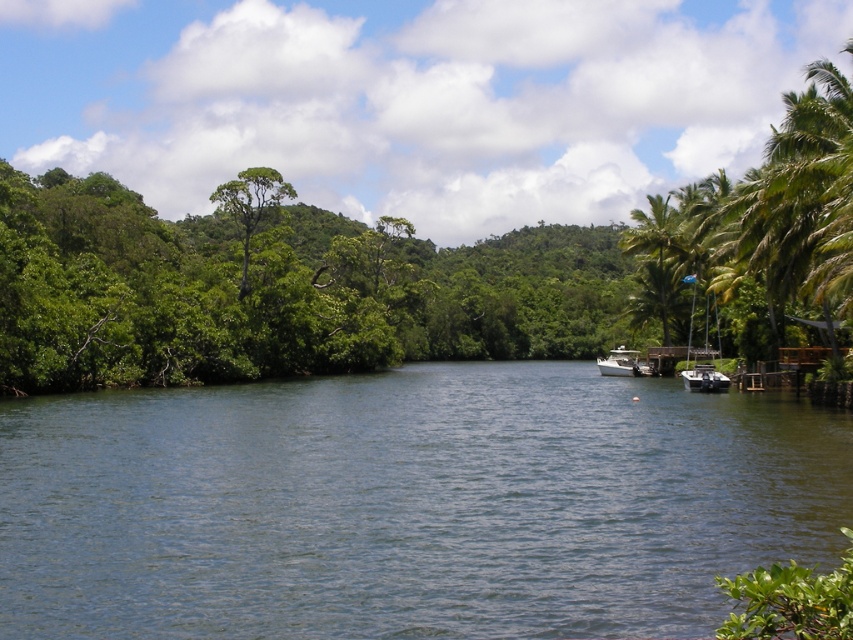
Does metallic silver boat at right appear over white glossy boat at center?

Actually, metallic silver boat at right is below white glossy boat at center.

Between point (698, 372) and point (602, 372), which one is positioned in front?

Positioned in front is point (698, 372).

This screenshot has width=853, height=640. What do you see at coordinates (704, 378) in the screenshot?
I see `metallic silver boat at right` at bounding box center [704, 378].

Locate an element on the screen. This screenshot has width=853, height=640. metallic silver boat at right is located at coordinates (704, 378).

Does green leafy tree at right appear on the right side of green leafy tree at center?

Yes, green leafy tree at right is to the right of green leafy tree at center.

Does green leafy tree at right appear on the left side of green leafy tree at center?

In fact, green leafy tree at right is to the right of green leafy tree at center.

The width and height of the screenshot is (853, 640). In order to click on green leafy tree at right in this screenshot , I will do `click(283, 291)`.

Which is more to the right, green leafy tree at right or green leafy palm tree at right?

green leafy palm tree at right

Who is taller, green leafy tree at right or green leafy palm tree at right?

green leafy palm tree at right is taller.

Does point (28, 305) come behind point (657, 225)?

No.

Find the location of a particular element. green leafy tree at right is located at coordinates (283, 291).